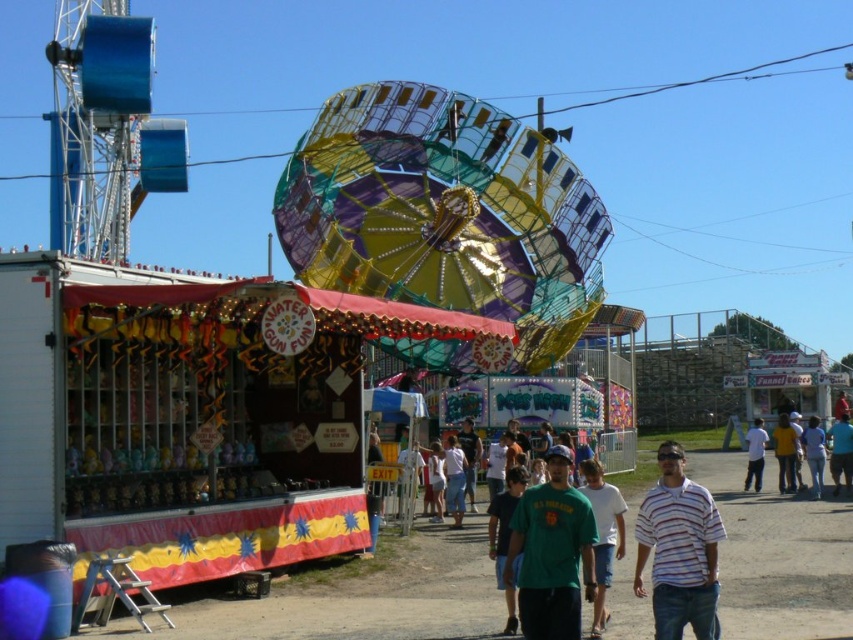
Question: Is green cotton shirt at center smaller than blue jeans at lower right?

Choices:
 (A) no
 (B) yes

Answer: (B)

Question: Which object appears closest to the camera in this image?

Choices:
 (A) white cotton shirt at lower right
 (B) green matte t-shirt at center
 (C) green cotton shirt at center
 (D) blue fabric shirt at lower right

Answer: (B)

Question: Which point is farther from the camera taking this photo?

Choices:
 (A) (706, 556)
 (B) (523, 484)

Answer: (B)

Question: Can you confirm if green matte shirt at center is wider than blue jeans at lower right?

Choices:
 (A) no
 (B) yes

Answer: (A)

Question: Is multicolored metallic ride at center to the left of blue jeans at lower right from the viewer's perspective?

Choices:
 (A) no
 (B) yes

Answer: (B)

Question: Estimate the real-world distances between objects in this image. Which object is farther from the white striped shirt at lower right?

Choices:
 (A) blue jeans at lower right
 (B) white cotton shirt at lower right
 (C) green matte shirt at center
 (D) multicolored metallic ride at center

Answer: (D)